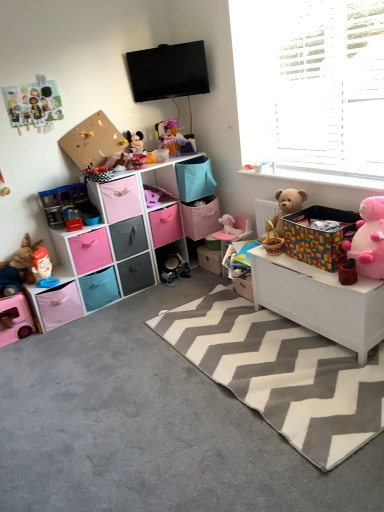
Identify the location of vacant space in front of pink fabric drawer at lower left, the 1th drawer positioned from the bottom. (99, 321).